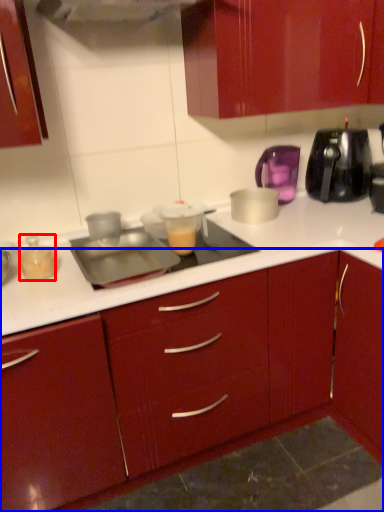
Question: Which point is closer to the camera, kitchen appliance (highlighted by a red box) or cabinetry (highlighted by a blue box)?

Choices:
 (A) kitchen appliance
 (B) cabinetry

Answer: (B)